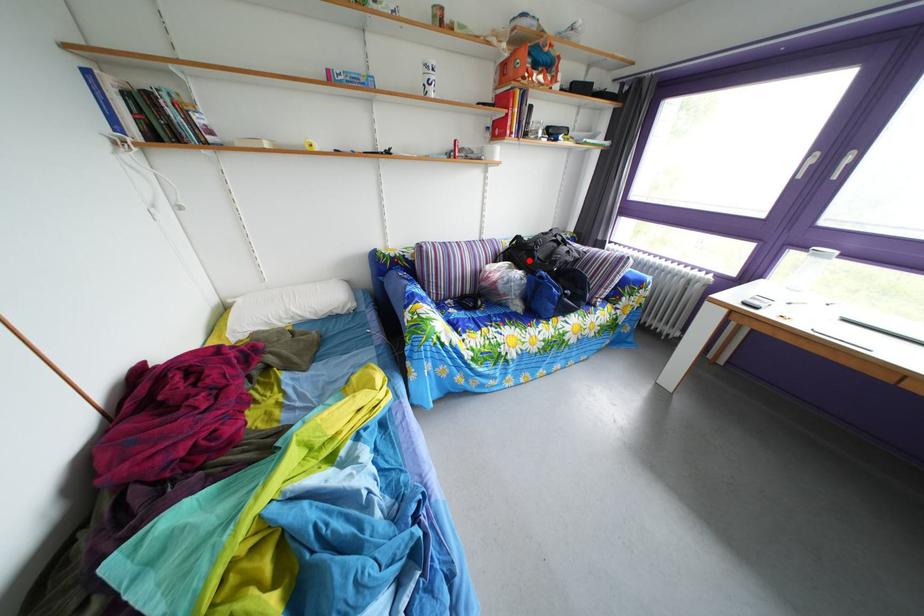
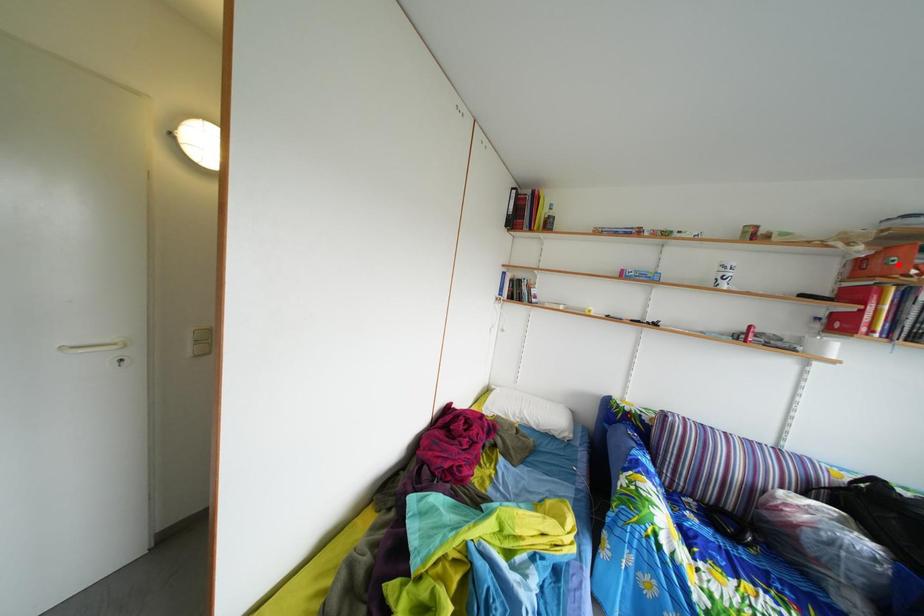
I am providing you with two images of the same scene from different viewpoints. A red point is marked on the first image and another point is marked on the second image. Is the marked point in image1 the same physical position as the marked point in image2?

No